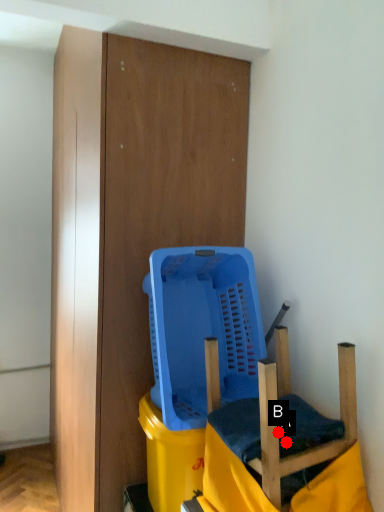
Question: Two points are circled on the image, labeled by A and B beside each circle. Which point appears closest to the camera in this image?

Choices:
 (A) A is closer
 (B) B is closer

Answer: (B)